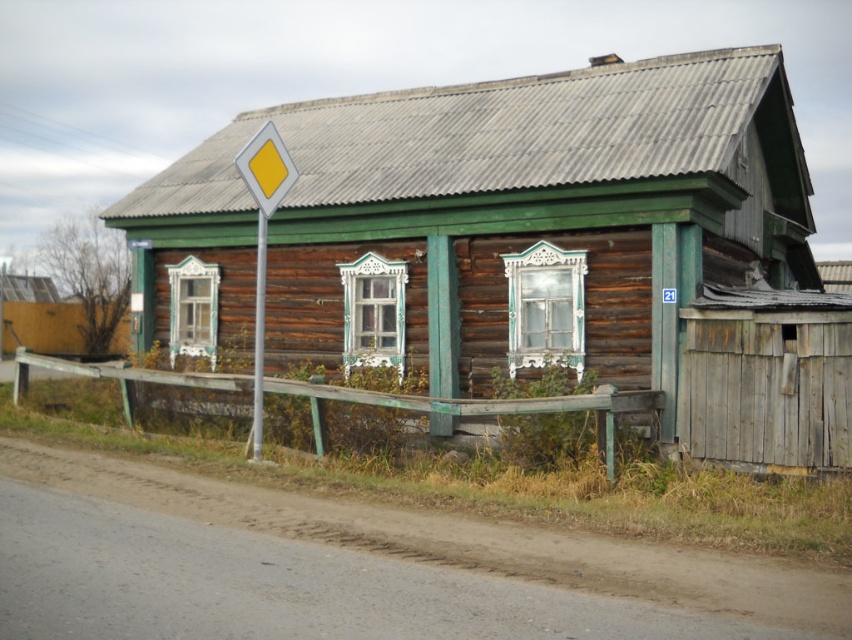
You are a delivery person approaching the wooden hut at center and the yellow plastic diamond at left. You need to know which object is taller to plan your route. Can you tell me which one is taller?

The wooden hut at center is taller than the yellow plastic diamond at left according to the description.

Looking at this image, you are standing on the paved road in front of the wooden hut at center and the metallic pole at left. Which object is nearer to you?

The wooden hut at center is closer to the viewer than the metallic pole at left, so the wooden hut at center is nearer to you.

You are standing on the porch of the rustic wooden house and want to walk to the road. There are two points marked on the ground in front of you. The first point is at coordinate point[502,358] and the second is at point[256,332]. Which point is closer to the road?

Point[502,358] is in front of point[256,332], so the closer point to the road is point[502,358].